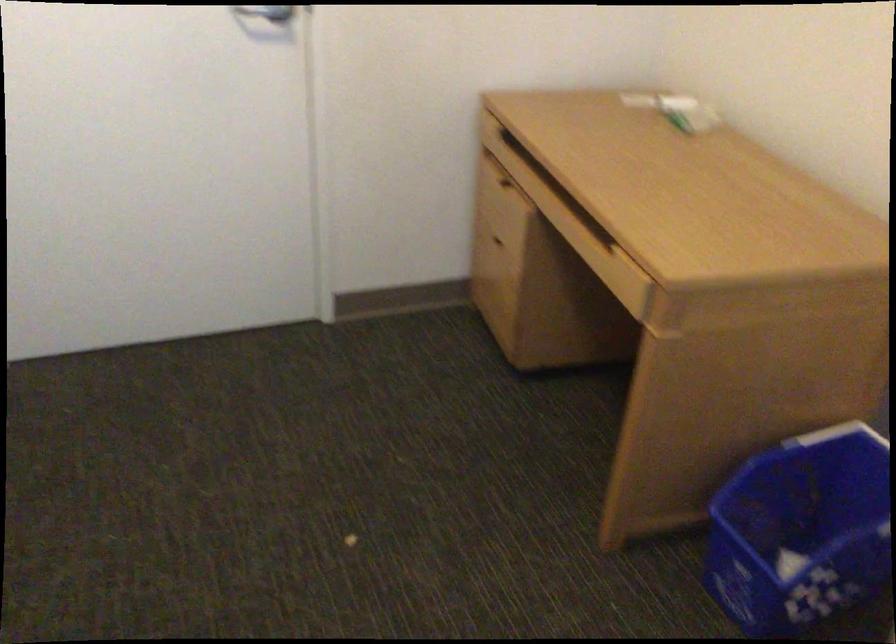
I want to click on silver door handle, so click(x=271, y=13).